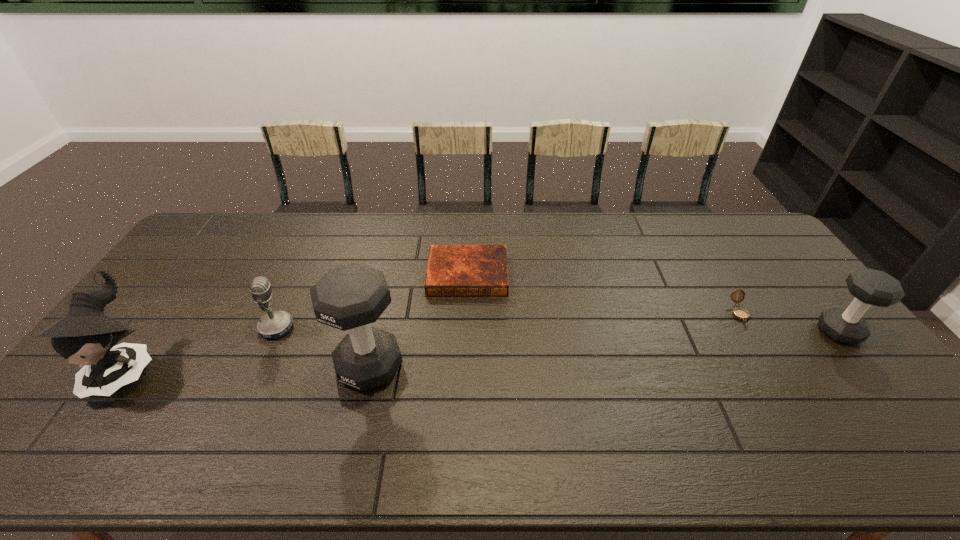
What are the coordinates of `the third object from right to left` in the screenshot? It's located at pos(452,270).

Where is `blank area located 0.190m on the back of the left dumbbell`? This screenshot has width=960, height=540. blank area located 0.190m on the back of the left dumbbell is located at coordinates (386, 293).

Locate an element on the screen. The image size is (960, 540). vacant space situated 0.090m on the left of the rightmost object is located at coordinates (787, 332).

Where is `vacant space located 0.210m on the face of the second shortest object`? This screenshot has height=540, width=960. vacant space located 0.210m on the face of the second shortest object is located at coordinates (783, 388).

You are a GUI agent. You are given a task and a screenshot of the screen. Output one action in this format:
    pyautogui.click(x=<x>, y=<y>)
    Task: Click on the blank space located on the front-facing side of the fifth object from right to left
    This screenshot has width=960, height=540.
    Given the screenshot: What is the action you would take?
    pyautogui.click(x=372, y=328)

You are a GUI agent. You are given a task and a screenshot of the screen. Output one action in this format:
    pyautogui.click(x=<x>, y=<y>)
    Task: Click on the vacant space positioned 0.180m on the spine side of the fourth object from left to right
    
    Given the screenshot: What is the action you would take?
    pyautogui.click(x=466, y=341)

Locate an element on the screen. Image resolution: width=960 pixels, height=540 pixels. dumbbell positioned at the near edge is located at coordinates (350, 297).

The width and height of the screenshot is (960, 540). What are the coordinates of `doll at the near edge` in the screenshot? It's located at (86, 336).

This screenshot has height=540, width=960. In order to click on object positioned at the left edge in this screenshot , I will do `click(86, 336)`.

You are a GUI agent. You are given a task and a screenshot of the screen. Output one action in this format:
    pyautogui.click(x=<x>, y=<y>)
    Task: Click on the object that is at the right edge
    The width and height of the screenshot is (960, 540).
    Given the screenshot: What is the action you would take?
    pyautogui.click(x=869, y=287)